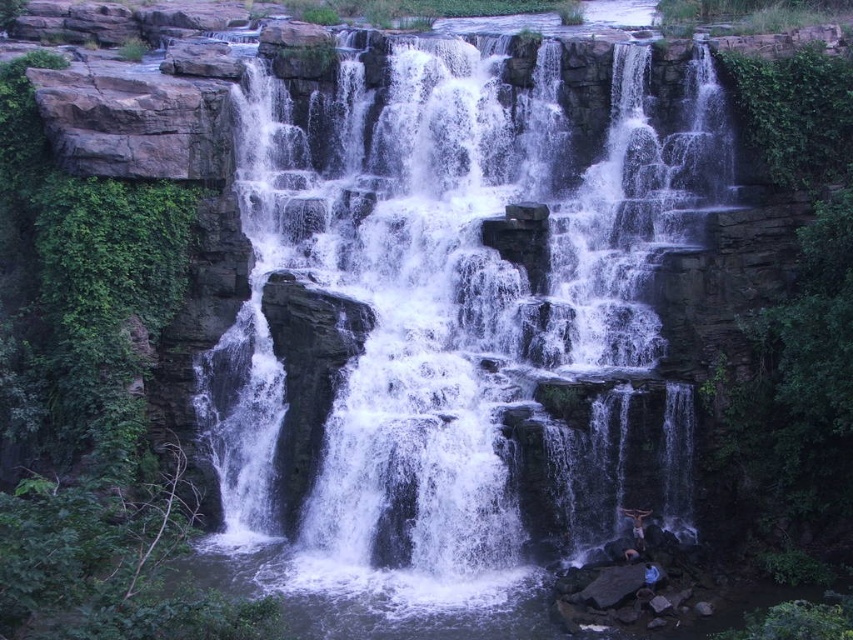
Between dark skin person at lower right and blue fabric person at lower right, which one has less height?

blue fabric person at lower right

Is dark skin person at lower right wider than blue fabric person at lower right?

Yes.

Is point (635, 515) positioned after point (651, 586)?

Yes, it is behind point (651, 586).

Where is `dark skin person at lower right`? dark skin person at lower right is located at coordinates (635, 531).

Is white frothy water at center taller than dark skin person at lower right?

Indeed, white frothy water at center has a greater height compared to dark skin person at lower right.

Does white frothy water at center appear over dark skin person at lower right?

Yes.

Is point (560, 298) closer to camera compared to point (628, 516)?

No.

Identify the location of white frothy water at center. The width and height of the screenshot is (853, 640). (440, 307).

Is white frothy water at center wider than blue fabric person at lower right?

Correct, the width of white frothy water at center exceeds that of blue fabric person at lower right.

Does white frothy water at center have a larger size compared to blue fabric person at lower right?

Yes.

Who is more forward, [506,397] or [648,588]?

Point [648,588]

I want to click on white frothy water at center, so click(x=440, y=307).